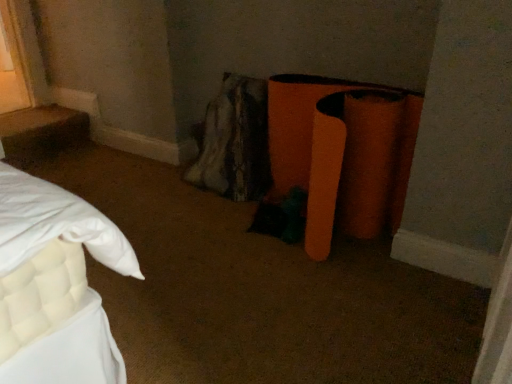
This screenshot has height=384, width=512. What are the coordinates of `free space in front of orange matte stool at lower right` in the screenshot? It's located at (322, 305).